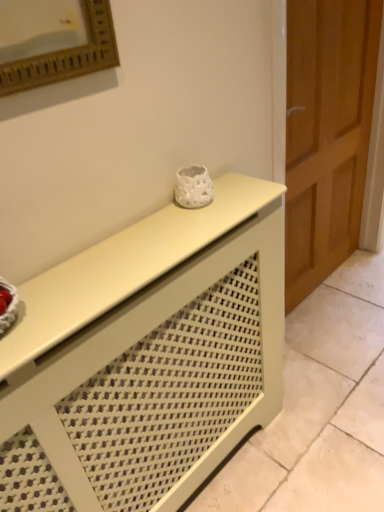
Question: From a real-world perspective, is matte white console table at center physically located above or below wooden door at right?

Choices:
 (A) above
 (B) below

Answer: (B)

Question: From the image's perspective, relative to wooden door at right, is matte white console table at center above or below?

Choices:
 (A) below
 (B) above

Answer: (A)

Question: In terms of width, does matte white console table at center look wider or thinner when compared to wooden door at right?

Choices:
 (A) wide
 (B) thin

Answer: (A)

Question: Is wooden door at right bigger or smaller than matte white console table at center?

Choices:
 (A) big
 (B) small

Answer: (A)

Question: From a real-world perspective, relative to matte white console table at center, is wooden door at right vertically above or below?

Choices:
 (A) above
 (B) below

Answer: (A)

Question: Does point (288, 211) appear closer or farther from the camera than point (198, 208)?

Choices:
 (A) farther
 (B) closer

Answer: (A)

Question: Would you say wooden door at right is to the left or to the right of matte white console table at center in the picture?

Choices:
 (A) right
 (B) left

Answer: (A)